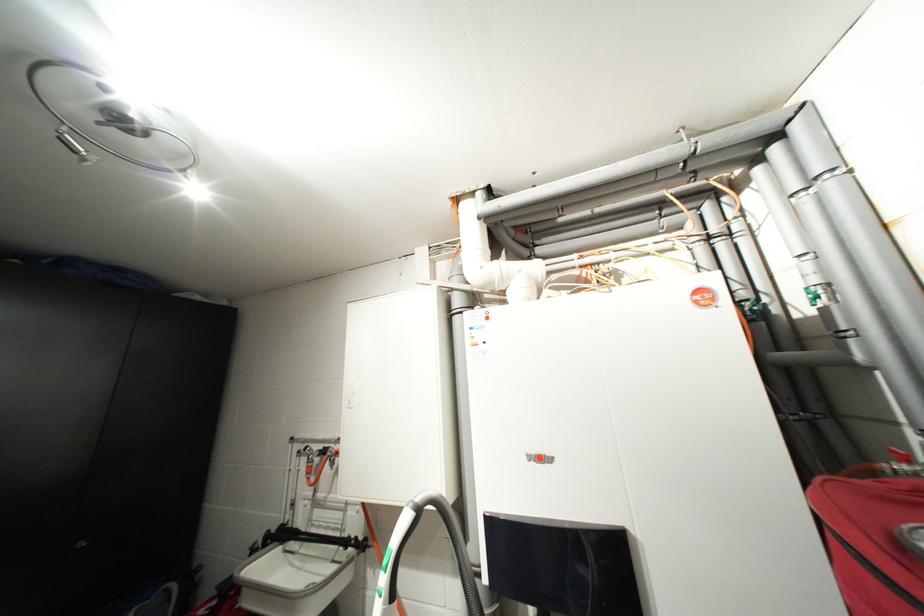
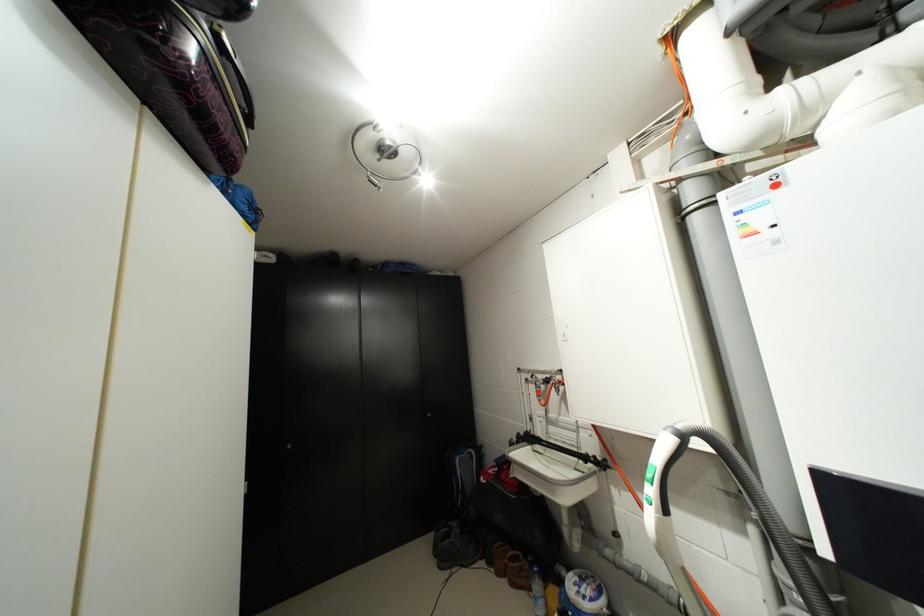
Question: I am providing you with two images of the same scene from different viewpoints. Which of the following objects are not visible in image2?

Choices:
 (A) blue backpack
 (B) silver cabinet handle
 (C) faucet handle
 (D) none of these

Answer: (D)